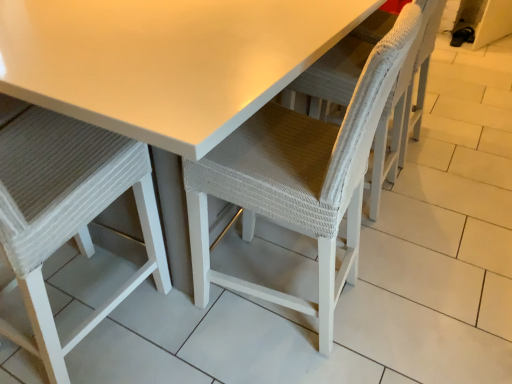
Where is `white woven chair at left, which is counted as the 2th chair, starting from the right`? This screenshot has height=384, width=512. white woven chair at left, which is counted as the 2th chair, starting from the right is located at coordinates coord(66,211).

What do you see at coordinates (166, 72) in the screenshot?
I see `white matte table at center` at bounding box center [166, 72].

Where is `white woven chair at center, acting as the first chair starting from the right`? white woven chair at center, acting as the first chair starting from the right is located at coordinates (298, 179).

This screenshot has height=384, width=512. Find the location of `white woven chair at left, which is counted as the 2th chair, starting from the right`. white woven chair at left, which is counted as the 2th chair, starting from the right is located at coordinates (66, 211).

Which of these two, white matte table at center or white woven chair at center, acting as the first chair starting from the right, stands shorter?

Standing shorter between the two is white matte table at center.

Is white matte table at center not near white woven chair at center, the 2th chair viewed from the left?

That's not correct — white matte table at center is a little close to white woven chair at center, the 2th chair viewed from the left.

Is white matte table at center turned away from white woven chair at center, acting as the first chair starting from the right?

No, white woven chair at center, acting as the first chair starting from the right, is not at the back of white matte table at center.

From the image's perspective, which is above, white matte table at center or white woven chair at center, the 2th chair viewed from the left?

From the image's view, white matte table at center is above.

Who is bigger, white woven chair at left, which is counted as the 2th chair, starting from the right, or white woven chair at center, acting as the first chair starting from the right?

white woven chair at center, acting as the first chair starting from the right, is bigger.

Is white woven chair at left, which is counted as the 2th chair, starting from the right, far from white woven chair at center, the 2th chair viewed from the left?

That's not correct — white woven chair at left, which is counted as the 2th chair, starting from the right, is a little close to white woven chair at center, the 2th chair viewed from the left.

Is white woven chair at left, placed as the first chair when sorted from left to right, turned away from white woven chair at center, the 2th chair viewed from the left?

That's not correct — white woven chair at left, placed as the first chair when sorted from left to right, is not looking away from white woven chair at center, the 2th chair viewed from the left.

Considering the positions of objects white matte table at center and white woven chair at left, which is counted as the 2th chair, starting from the right, in the image provided, who is more to the left, white matte table at center or white woven chair at left, which is counted as the 2th chair, starting from the right,?

white woven chair at left, which is counted as the 2th chair, starting from the right, is more to the left.

Are white matte table at center and white woven chair at left, placed as the first chair when sorted from left to right, far apart?

No, white matte table at center is not far away from white woven chair at left, placed as the first chair when sorted from left to right.

Is white matte table at center situated inside white woven chair at left, which is counted as the 2th chair, starting from the right, or outside?

white matte table at center cannot be found inside white woven chair at left, which is counted as the 2th chair, starting from the right.

Consider the image. Is white matte table at center positioned behind white woven chair at left, which is counted as the 2th chair, starting from the right?

Yes, it is.

From a real-world perspective, which object stands above the other?

In real-world perspective, white woven chair at center, the 2th chair viewed from the left, is above.

Is point (320, 291) closer or farther from the camera than point (35, 28)?

Point (320, 291).

Between white woven chair at center, the 2th chair viewed from the left, and white matte table at center, which one has larger width?

white matte table at center is wider.

Could you tell me if white woven chair at center, the 2th chair viewed from the left, is turned towards white matte table at center?

Yes, white woven chair at center, the 2th chair viewed from the left, faces towards white matte table at center.

From the image's perspective, which is above, white woven chair at center, the 2th chair viewed from the left, or white woven chair at left, which is counted as the 2th chair, starting from the right?

white woven chair at center, the 2th chair viewed from the left.

Considering the sizes of objects white woven chair at center, acting as the first chair starting from the right, and white woven chair at left, which is counted as the 2th chair, starting from the right, in the image provided, who is bigger, white woven chair at center, acting as the first chair starting from the right, or white woven chair at left, which is counted as the 2th chair, starting from the right,?

white woven chair at center, acting as the first chair starting from the right, is bigger.

Based on the photo, between white woven chair at center, acting as the first chair starting from the right, and white woven chair at left, placed as the first chair when sorted from left to right, which one has smaller width?

white woven chair at center, acting as the first chair starting from the right.

Which object is positioned more to the left, white woven chair at center, acting as the first chair starting from the right, or white woven chair at left, which is counted as the 2th chair, starting from the right?

Positioned to the left is white woven chair at left, which is counted as the 2th chair, starting from the right.

From the image's perspective, starting from the white matte table at center, which chair is the 2nd one below? Please provide its 2D coordinates.

[(66, 211)]

How different are the orientations of white woven chair at left, placed as the first chair when sorted from left to right, and white matte table at center in degrees?

They differ by 89.9 degrees in their facing directions.

Which object is closer to the camera, white woven chair at left, which is counted as the 2th chair, starting from the right, or white matte table at center?

white woven chair at left, which is counted as the 2th chair, starting from the right.

Considering the sizes of objects white woven chair at left, placed as the first chair when sorted from left to right, and white matte table at center in the image provided, who is wider, white woven chair at left, placed as the first chair when sorted from left to right, or white matte table at center?

With larger width is white matte table at center.

From the image's perspective, starting from the white matte table at center, which chair is the 1st one below? Please provide its 2D coordinates.

[(298, 179)]

Locate an element on the screen. The width and height of the screenshot is (512, 384). chair in front of the white woven chair at center, the 2th chair viewed from the left is located at coordinates (66, 211).

Considering their positions, is white matte table at center positioned further to white woven chair at center, acting as the first chair starting from the right, than white woven chair at left, placed as the first chair when sorted from left to right?

white woven chair at left, placed as the first chair when sorted from left to right.

From the image, which object appears to be farther from white woven chair at center, acting as the first chair starting from the right, white woven chair at left, placed as the first chair when sorted from left to right, or white matte table at center?

white woven chair at left, placed as the first chair when sorted from left to right, is positioned further to the anchor white woven chair at center, acting as the first chair starting from the right.

Considering their positions, is white matte table at center positioned further to white woven chair at left, which is counted as the 2th chair, starting from the right, than white woven chair at center, the 2th chair viewed from the left?

The object further to white woven chair at left, which is counted as the 2th chair, starting from the right, is white woven chair at center, the 2th chair viewed from the left.

Estimate the real-world distances between objects in this image. Which object is closer to white matte table at center, white woven chair at center, acting as the first chair starting from the right, or white woven chair at left, placed as the first chair when sorted from left to right?

Among the two, white woven chair at center, acting as the first chair starting from the right, is located nearer to white matte table at center.

Estimate the real-world distances between objects in this image. Which object is closer to white woven chair at left, which is counted as the 2th chair, starting from the right, white woven chair at center, the 2th chair viewed from the left, or white matte table at center?

The object closer to white woven chair at left, which is counted as the 2th chair, starting from the right, is white matte table at center.

From the image, which object appears to be farther from white matte table at center, white woven chair at left, placed as the first chair when sorted from left to right, or white woven chair at center, acting as the first chair starting from the right?

The object further to white matte table at center is white woven chair at left, placed as the first chair when sorted from left to right.

This screenshot has height=384, width=512. I want to click on table between white woven chair at left, placed as the first chair when sorted from left to right, and white woven chair at center, the 2th chair viewed from the left, so click(x=166, y=72).